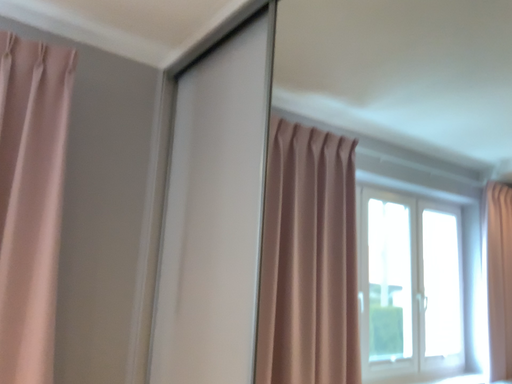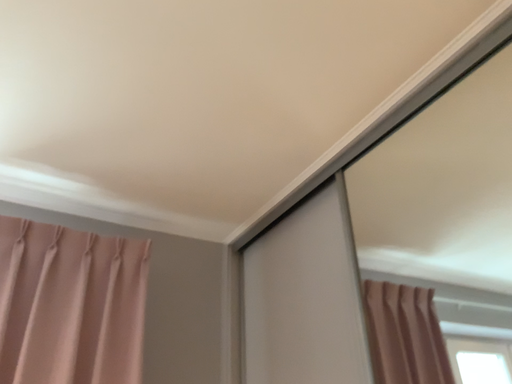
Question: Which way did the camera rotate in the video?

Choices:
 (A) rotated downward
 (B) rotated upward

Answer: (B)